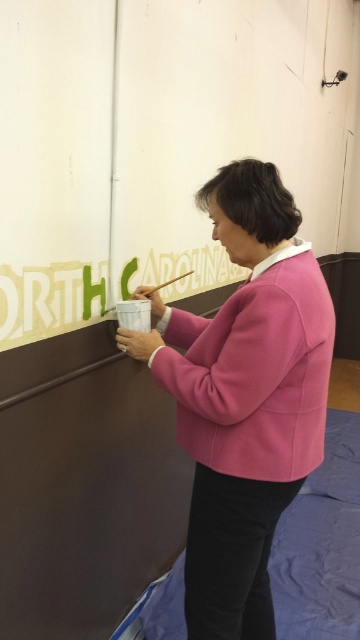
Question: Which of the following is the farthest from the observer?

Choices:
 (A) (321, 320)
 (B) (259, 467)
 (C) (176, 278)

Answer: (C)

Question: Does matte pink sweatshirt at center lie behind wooden paintbrush at upper center?

Choices:
 (A) yes
 (B) no

Answer: (B)

Question: Is pink woolen sweater at center below matte pink sweatshirt at center?

Choices:
 (A) no
 (B) yes

Answer: (B)

Question: Which object appears farthest from the camera in this image?

Choices:
 (A) pink woolen sweater at center
 (B) wooden paintbrush at upper center

Answer: (B)

Question: Is matte pink sweatshirt at center closer to camera compared to wooden paintbrush at upper center?

Choices:
 (A) yes
 (B) no

Answer: (A)

Question: Which is nearer to the matte pink sweatshirt at center?

Choices:
 (A) pink woolen sweater at center
 (B) wooden paintbrush at upper center

Answer: (A)